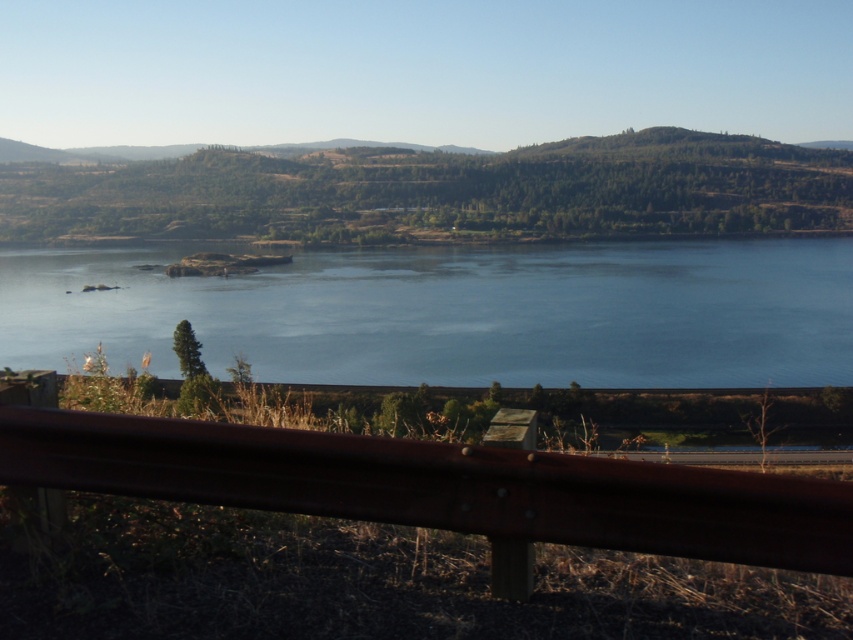
Question: Which object is closer to the camera taking this photo?

Choices:
 (A) brown metallic rail at lower center
 (B) blue water at center

Answer: (A)

Question: Considering the relative positions of blue water at center and brown metallic rail at lower center in the image provided, where is blue water at center located with respect to brown metallic rail at lower center?

Choices:
 (A) above
 (B) below

Answer: (A)

Question: Which point is farther from the camera taking this photo?

Choices:
 (A) (409, 468)
 (B) (680, 372)

Answer: (B)

Question: Does blue water at center come behind brown metallic rail at lower center?

Choices:
 (A) no
 (B) yes

Answer: (B)

Question: Can you confirm if blue water at center is thinner than brown metallic rail at lower center?

Choices:
 (A) yes
 (B) no

Answer: (A)